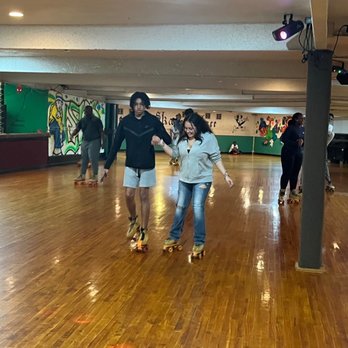
This screenshot has width=348, height=348. Find the location of `green paint`. green paint is located at coordinates (275, 148), (244, 144), (17, 112), (74, 105), (71, 145), (269, 132).